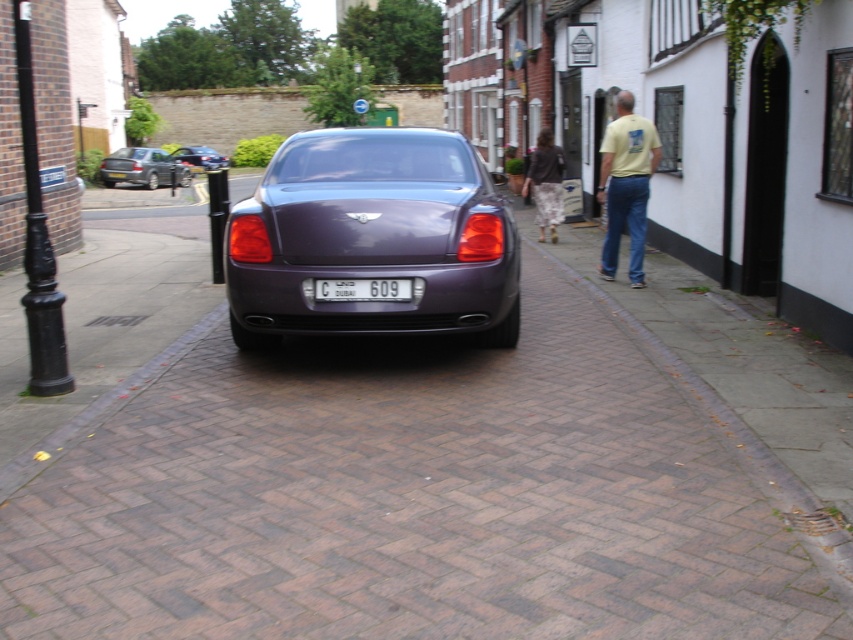
Question: Does brick pavement at center have a lesser width compared to shiny metallic car at center?

Choices:
 (A) yes
 (B) no

Answer: (B)

Question: Considering the real-world distances, which object is closest to the metallic silver sedan at upper left?

Choices:
 (A) white plastic license plate at center
 (B) camouflage pants at center
 (C) brick pavement at center

Answer: (B)

Question: Which point appears farthest from the camera in this image?

Choices:
 (A) (323, 278)
 (B) (618, 102)
 (C) (291, 259)

Answer: (B)

Question: Considering the relative positions of brick pavement at center and satin purple car at center in the image provided, where is brick pavement at center located with respect to satin purple car at center?

Choices:
 (A) below
 (B) above

Answer: (A)

Question: Observing the image, what is the correct spatial positioning of camouflage pants at center in reference to shiny metallic car at center?

Choices:
 (A) left
 (B) right

Answer: (B)

Question: Which point is closer to the camera?

Choices:
 (A) (210, 164)
 (B) (115, 170)
 (C) (303, 145)
 (D) (318, 294)

Answer: (D)